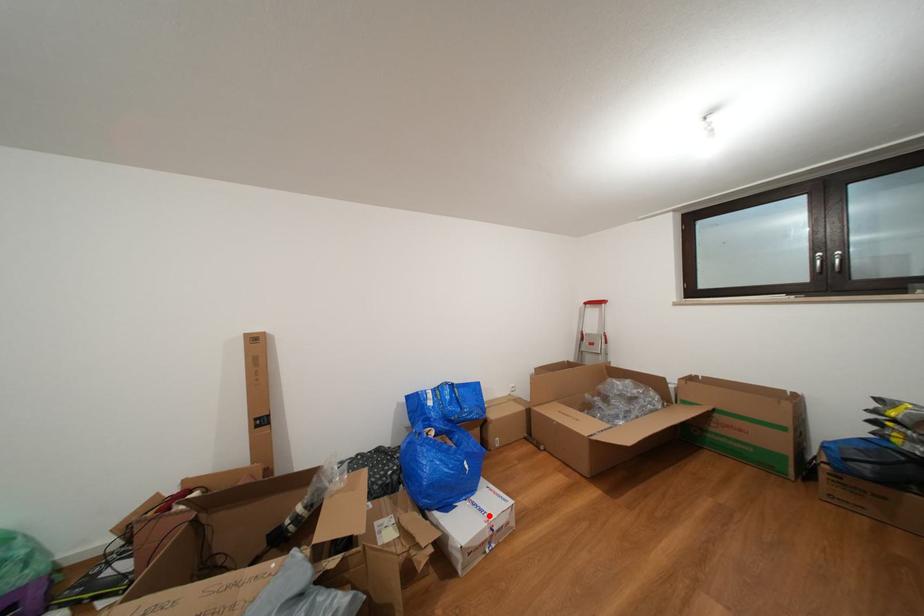
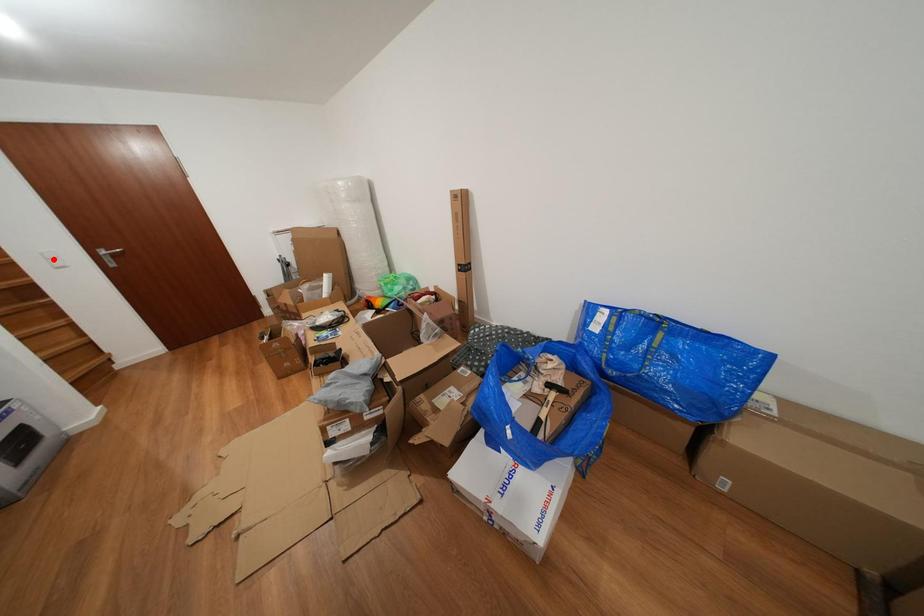
I am providing you with two images of the same scene from different viewpoints. A red point is marked on the first image and another point is marked on the second image. Is the red point in image1 aligned with the point shown in image2?

No